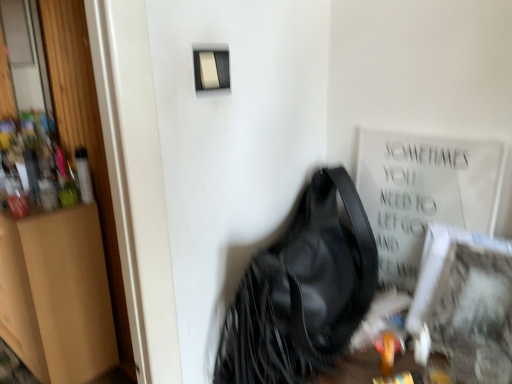
Question: Is black leather handbag at center completely or partially outside of white textured frame at lower right?

Choices:
 (A) yes
 (B) no

Answer: (A)

Question: Is black leather handbag at center at the left side of white textured frame at lower right?

Choices:
 (A) no
 (B) yes

Answer: (B)

Question: From the image's perspective, would you say black leather handbag at center is positioned over white textured frame at lower right?

Choices:
 (A) no
 (B) yes

Answer: (A)

Question: Can you confirm if black leather handbag at center is smaller than white textured frame at lower right?

Choices:
 (A) no
 (B) yes

Answer: (A)

Question: Is black leather handbag at center next to white textured frame at lower right and touching it?

Choices:
 (A) no
 (B) yes

Answer: (A)

Question: Considering the relative positions of black leather handbag at center and white textured frame at lower right in the image provided, is black leather handbag at center to the right of white textured frame at lower right from the viewer's perspective?

Choices:
 (A) no
 (B) yes

Answer: (A)

Question: Is the position of brown cardboard dresser at left less distant than that of matte plastic light switch at upper center?

Choices:
 (A) yes
 (B) no

Answer: (B)

Question: Is brown cardboard dresser at left outside matte plastic light switch at upper center?

Choices:
 (A) yes
 (B) no

Answer: (A)

Question: From the image's perspective, does brown cardboard dresser at left appear lower than matte plastic light switch at upper center?

Choices:
 (A) no
 (B) yes

Answer: (B)

Question: From the image's perspective, would you say brown cardboard dresser at left is positioned over matte plastic light switch at upper center?

Choices:
 (A) no
 (B) yes

Answer: (A)

Question: Can you see brown cardboard dresser at left touching matte plastic light switch at upper center?

Choices:
 (A) yes
 (B) no

Answer: (B)

Question: Is brown cardboard dresser at left shorter than matte plastic light switch at upper center?

Choices:
 (A) yes
 (B) no

Answer: (B)

Question: Can you confirm if white textured frame at lower right is shorter than brown cardboard dresser at left?

Choices:
 (A) no
 (B) yes

Answer: (B)